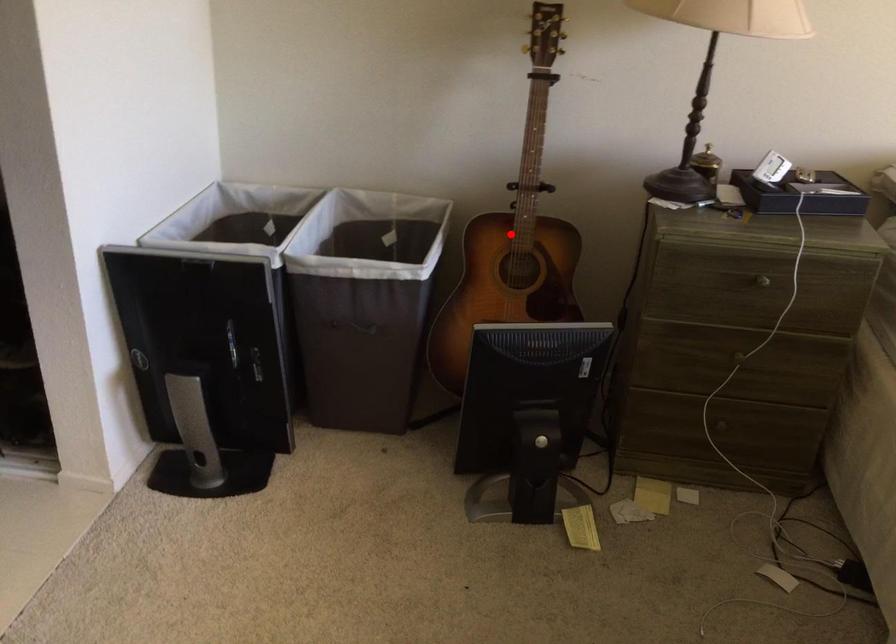
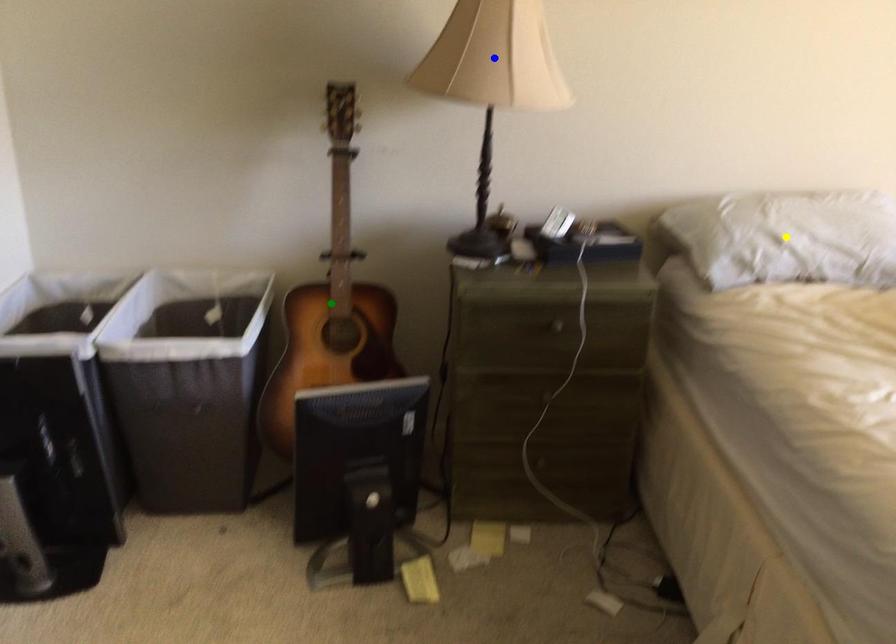
Question: I am providing you with two images of the same scene from different viewpoints. A red point is marked on the first image. You are given multiple points on the second image. Which point in image 2 represents the same 3d spot as the red point in image 1?

Choices:
 (A) yellow point
 (B) green point
 (C) blue point

Answer: (B)